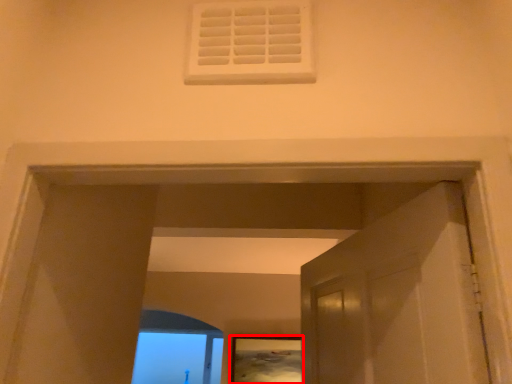
Question: In this image, where is picture frame (annotated by the red box) located relative to window frame?

Choices:
 (A) left
 (B) right

Answer: (B)